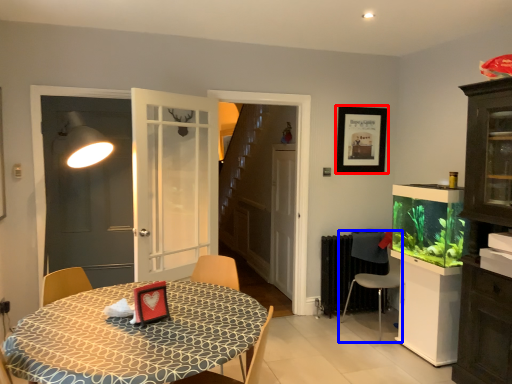
Question: Which of the following is the closest to the observer, picture frame (highlighted by a red box) or chair (highlighted by a blue box)?

Choices:
 (A) picture frame
 (B) chair

Answer: (B)